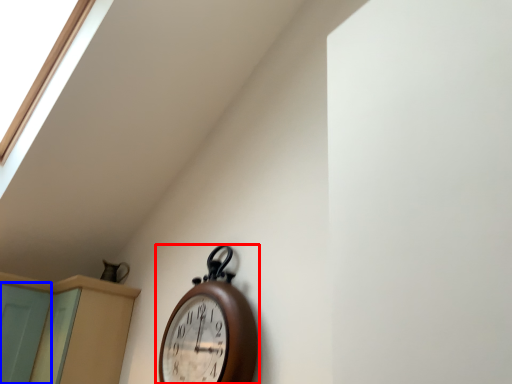
Question: Among these objects, which one is farthest to the camera, wall clock (highlighted by a red box) or screen door (highlighted by a blue box)?

Choices:
 (A) wall clock
 (B) screen door

Answer: (B)